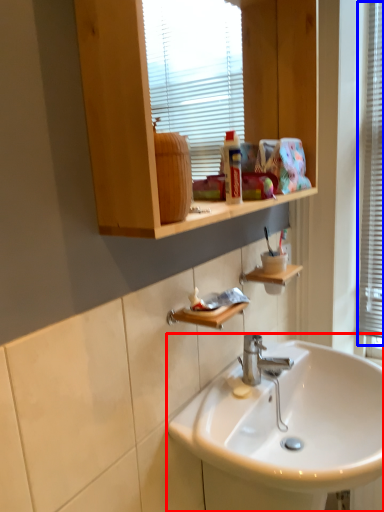
Question: Which point is further to the camera, sink (highlighted by a red box) or window frame (highlighted by a blue box)?

Choices:
 (A) sink
 (B) window frame

Answer: (B)